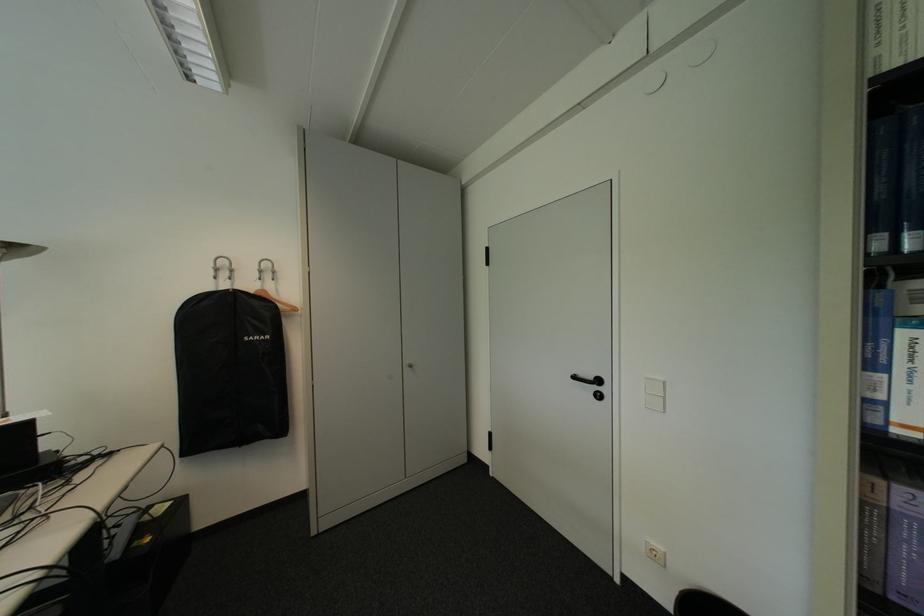
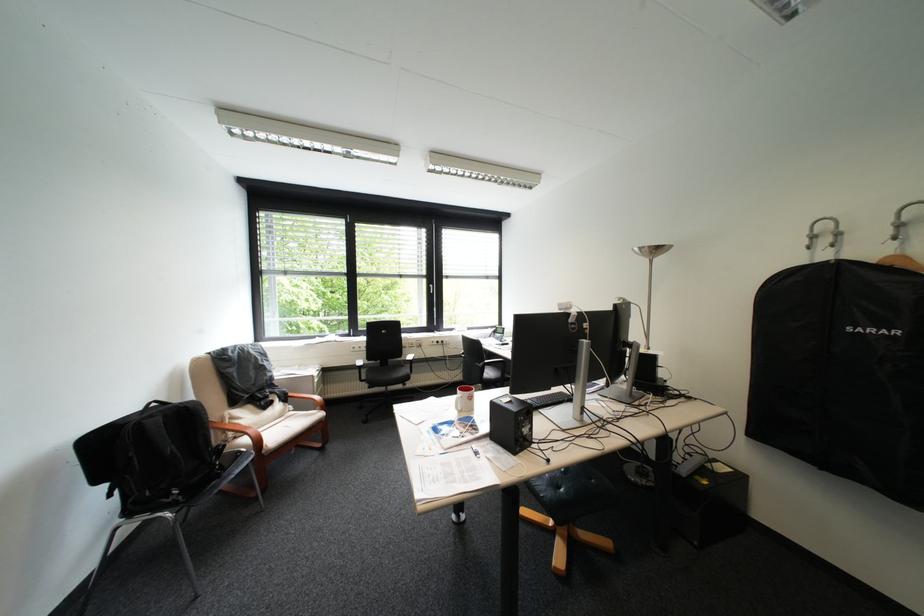
In the second image, find the point that corresponds to the point at 269,339 in the first image.

(883, 331)